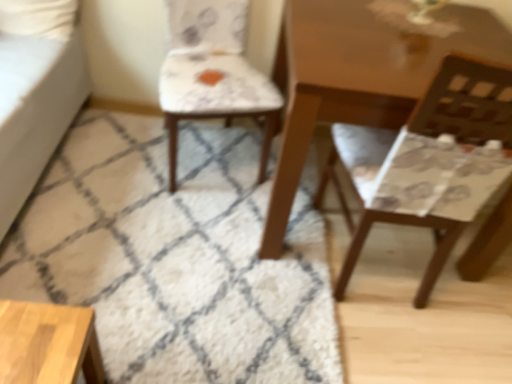
Question: Is the depth of white shaggy rug at center greater than that of matte brown chair at right, marked as the 1th chair in a right-to-left arrangement?

Choices:
 (A) yes
 (B) no

Answer: (A)

Question: Is white shaggy rug at center at the left side of matte brown chair at right, the 2th chair when ordered from left to right?

Choices:
 (A) no
 (B) yes

Answer: (B)

Question: From the image's perspective, would you say white shaggy rug at center is shown under matte brown chair at right, marked as the 1th chair in a right-to-left arrangement?

Choices:
 (A) yes
 (B) no

Answer: (A)

Question: Is white shaggy rug at center positioned beyond the bounds of matte brown chair at right, marked as the 1th chair in a right-to-left arrangement?

Choices:
 (A) yes
 (B) no

Answer: (A)

Question: From a real-world perspective, is white shaggy rug at center on top of matte brown chair at right, marked as the 1th chair in a right-to-left arrangement?

Choices:
 (A) no
 (B) yes

Answer: (A)

Question: Is white shaggy rug at center taller than matte brown chair at right, marked as the 1th chair in a right-to-left arrangement?

Choices:
 (A) yes
 (B) no

Answer: (B)

Question: From a real-world perspective, is patterned fabric chair at center, the first chair in the left-to-right sequence, physically above matte brown chair at right, the 2th chair when ordered from left to right?

Choices:
 (A) no
 (B) yes

Answer: (A)

Question: Considering the relative sizes of patterned fabric chair at center, the second chair viewed from the right, and matte brown chair at right, marked as the 1th chair in a right-to-left arrangement, in the image provided, is patterned fabric chair at center, the second chair viewed from the right, thinner than matte brown chair at right, marked as the 1th chair in a right-to-left arrangement,?

Choices:
 (A) no
 (B) yes

Answer: (A)

Question: Does patterned fabric chair at center, the second chair viewed from the right, turn towards matte brown chair at right, the 2th chair when ordered from left to right?

Choices:
 (A) no
 (B) yes

Answer: (A)

Question: Does patterned fabric chair at center, the first chair in the left-to-right sequence, have a larger size compared to matte brown chair at right, marked as the 1th chair in a right-to-left arrangement?

Choices:
 (A) no
 (B) yes

Answer: (A)

Question: Are patterned fabric chair at center, the second chair viewed from the right, and matte brown chair at right, the 2th chair when ordered from left to right, beside each other?

Choices:
 (A) yes
 (B) no

Answer: (B)

Question: Is patterned fabric chair at center, the second chair viewed from the right, wider than matte brown chair at right, marked as the 1th chair in a right-to-left arrangement?

Choices:
 (A) no
 (B) yes

Answer: (B)

Question: Considering the relative sizes of matte brown chair at right, the 2th chair when ordered from left to right, and white shaggy rug at center in the image provided, is matte brown chair at right, the 2th chair when ordered from left to right, thinner than white shaggy rug at center?

Choices:
 (A) yes
 (B) no

Answer: (A)